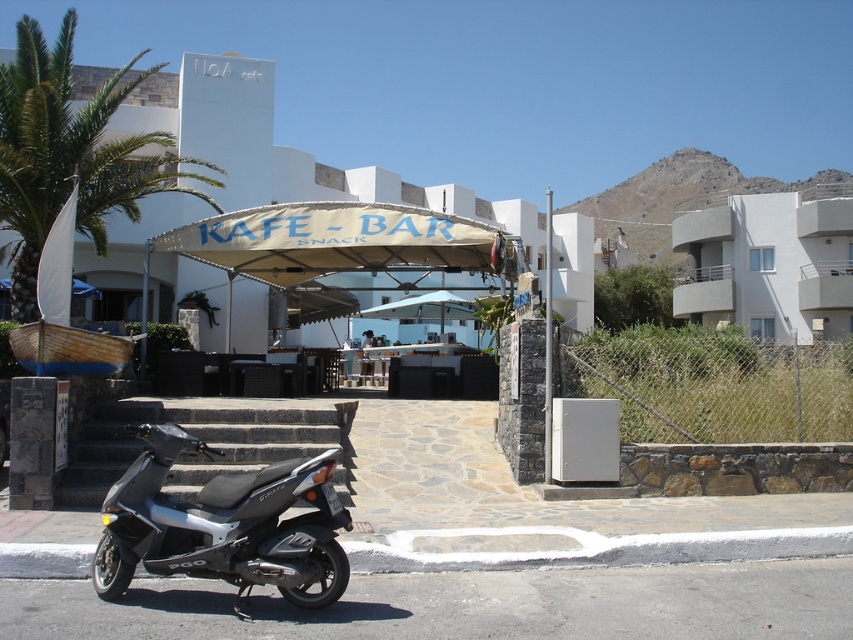
You are standing on the paved walkway in front of the KAFE BAR. You want to take a photo of the white matte building at center with the green leafy palm tree at upper left in the background. Will the palm tree appear larger or smaller in the photo compared to the building?

The white matte building at center has a smaller size compared to green leafy palm tree at upper left, so the palm tree will appear larger in the photo compared to the building.

You are standing at the entrance of the KAFE BAR and want to take a photo of the white matte building at center and the green leafy palm tree at upper left. Which object should you position to your left to include both in the frame?

You should position the green leafy palm tree at upper left to your left since the white matte building at center is to the right of it.